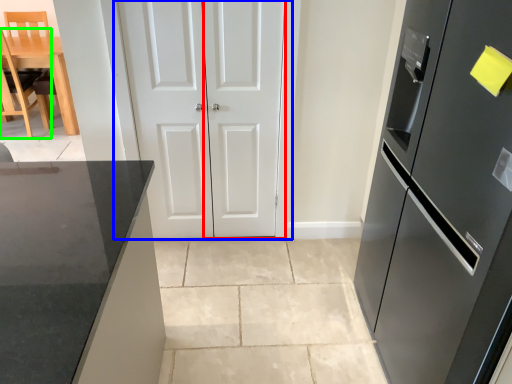
Question: Estimate the real-world distances between objects in this image. Which object is closer to door (highlighted by a red box), door (highlighted by a blue box) or chair (highlighted by a green box)?

Choices:
 (A) door
 (B) chair

Answer: (A)